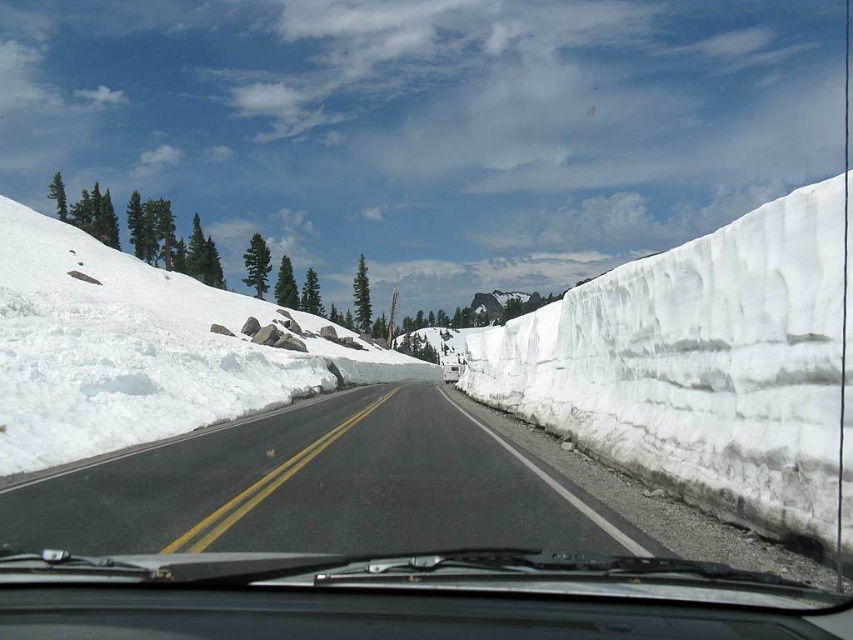
Between black asphalt road at center and white fluffy snow at left, which one is positioned lower?

black asphalt road at center is below.

The width and height of the screenshot is (853, 640). I want to click on black asphalt road at center, so click(x=315, y=486).